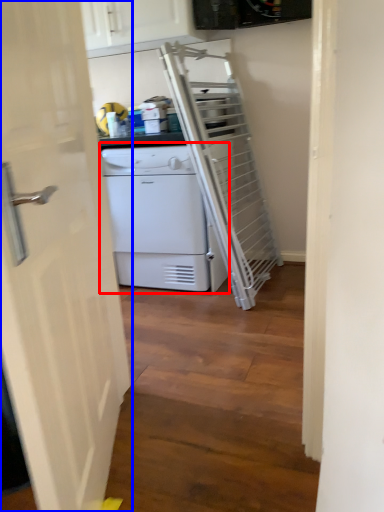
Question: Which point is closer to the camera, home appliance (highlighted by a red box) or door (highlighted by a blue box)?

Choices:
 (A) home appliance
 (B) door

Answer: (B)